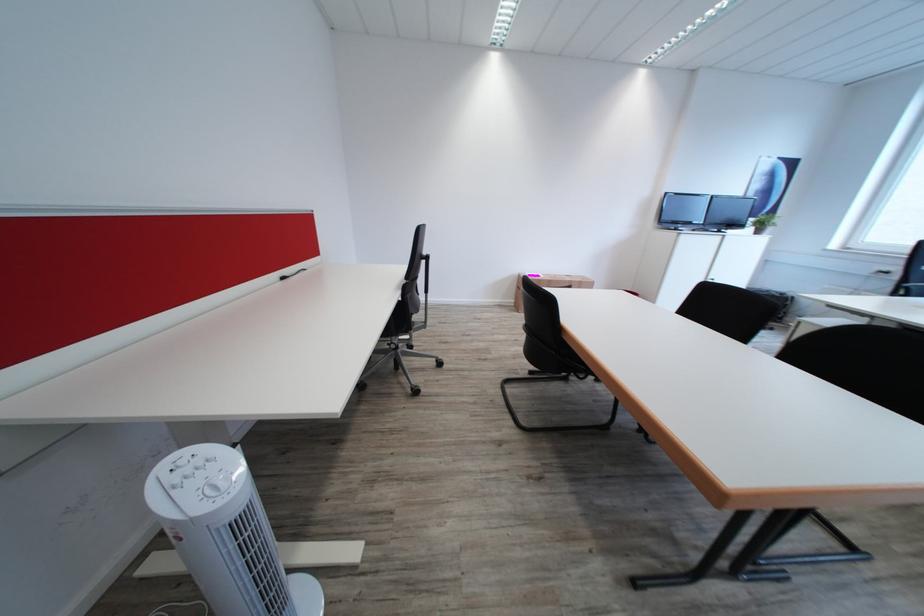
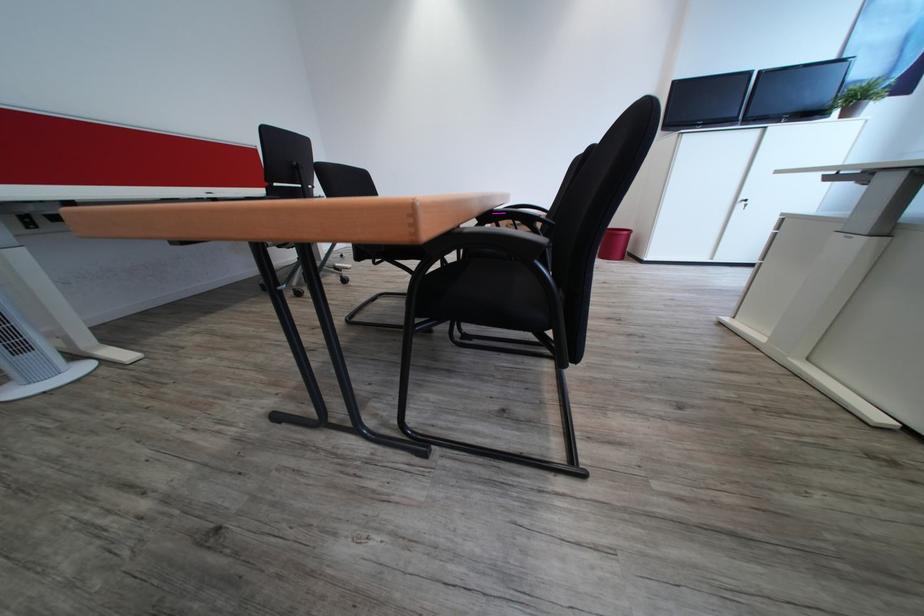
Question: Which direction would the cameraman need to move to produce the second image? Reply with the corresponding letter.

Choices:
 (A) Left
 (B) Right
 (C) Forward
 (D) Backward

Answer: (B)